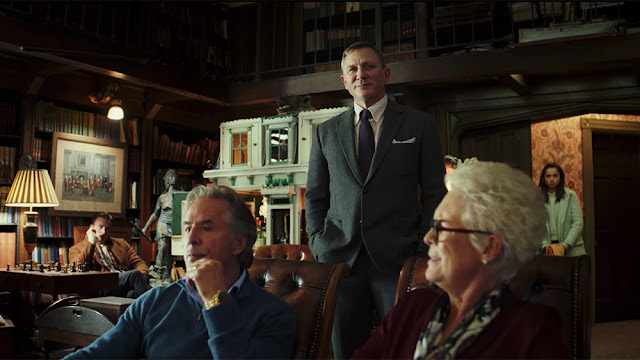
Where is `picture frame`? This screenshot has height=360, width=640. picture frame is located at coordinates (64, 134), (129, 176), (83, 213), (51, 162).